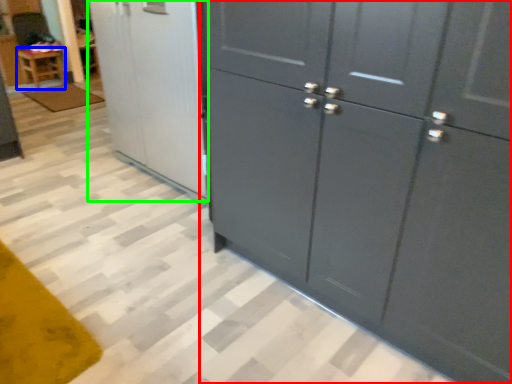
Question: Based on their relative distances, which object is nearer to cupboard (highlighted by a red box)? Choose from furniture (highlighted by a blue box) and screen door (highlighted by a green box).

Choices:
 (A) furniture
 (B) screen door

Answer: (B)